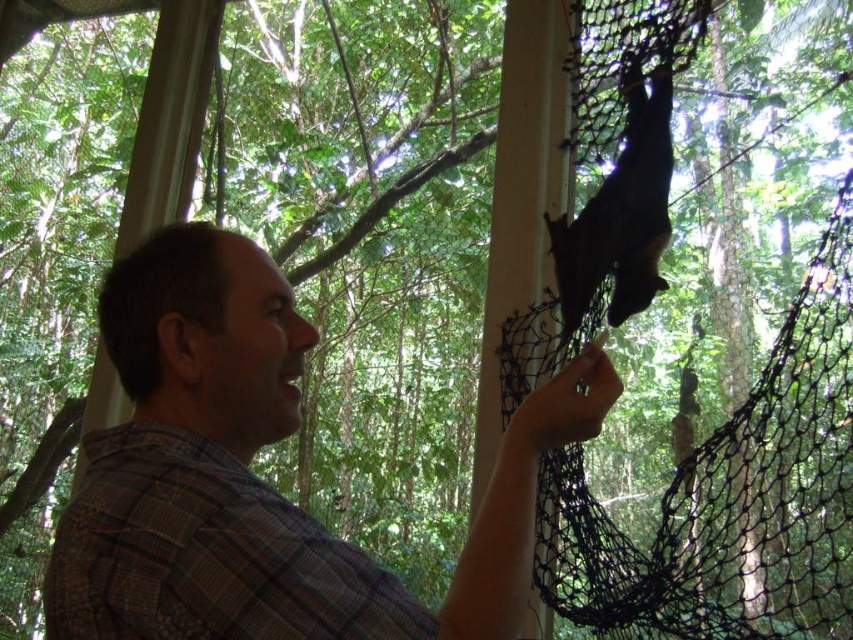
From the picture: How much distance is there between plaid shirt at center and black fur bat at upper center?

plaid shirt at center is 14.83 inches from black fur bat at upper center.

Is plaid shirt at center positioned behind black fur bat at upper center?

That is False.

Is point (77, 557) positioned in front of point (570, 278)?

That is True.

Find the location of `plaid shirt at center`. plaid shirt at center is located at coordinates (257, 477).